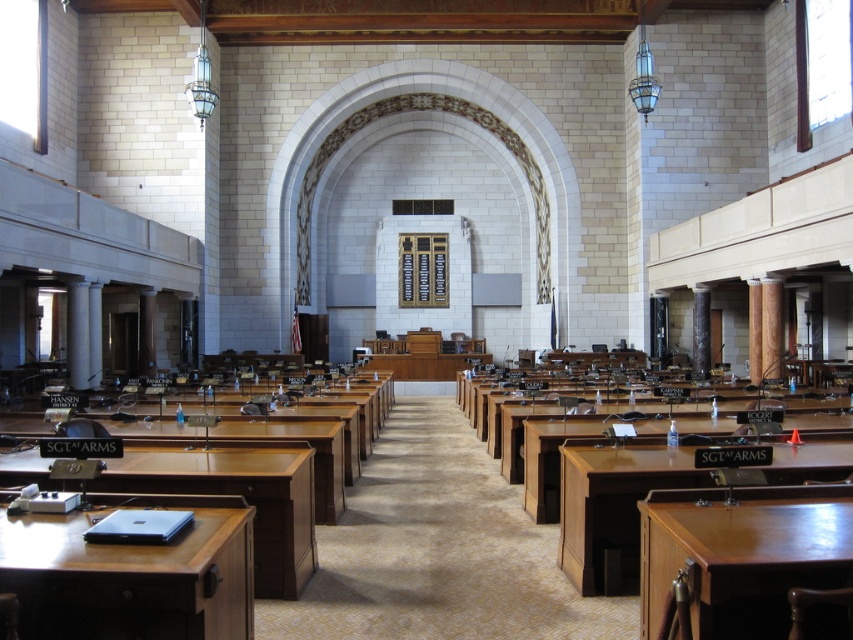
You are a visitor in this assembly room and need to place a narrow document on a table or desk. Which object, the brown wood table at lower left or the wooden desk at center, is more suitable for placing a narrow document?

The brown wood table at lower left is thinner than the wooden desk at center, so it is more suitable for placing a narrow document because its narrower width allows better accommodation of the document without excess space.

You are standing in the assembly room and want to place a large document on the nearest table. Which table should you choose between the brown wood table at lower left and the brown polished wood table at lower right?

The brown wood table at lower left is closer to you, so you should place the document there.

You are standing in the assembly room and want to place a decorative vase on the brown wood table at lower left. The table is at point (x=236, y=493). Can you reach the table from your current position at point 0.5, 0.5?

Yes, you can reach the brown wood table at lower left from point 0.5, 0.5 because the table is located at point (x=236, y=493) which is within the room and accessible.